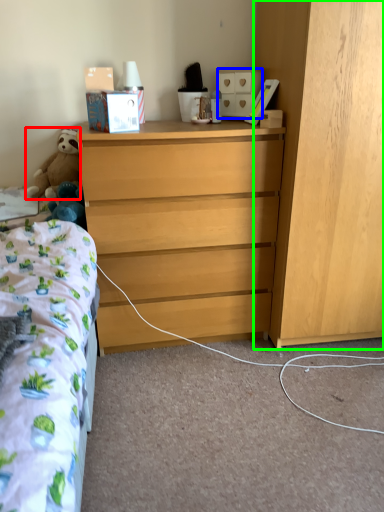
Question: Based on their relative distances, which object is farther from teddy bear (highlighted by a red box)? Choose from cabinetry (highlighted by a blue box) and cabinetry (highlighted by a green box).

Choices:
 (A) cabinetry
 (B) cabinetry

Answer: (B)